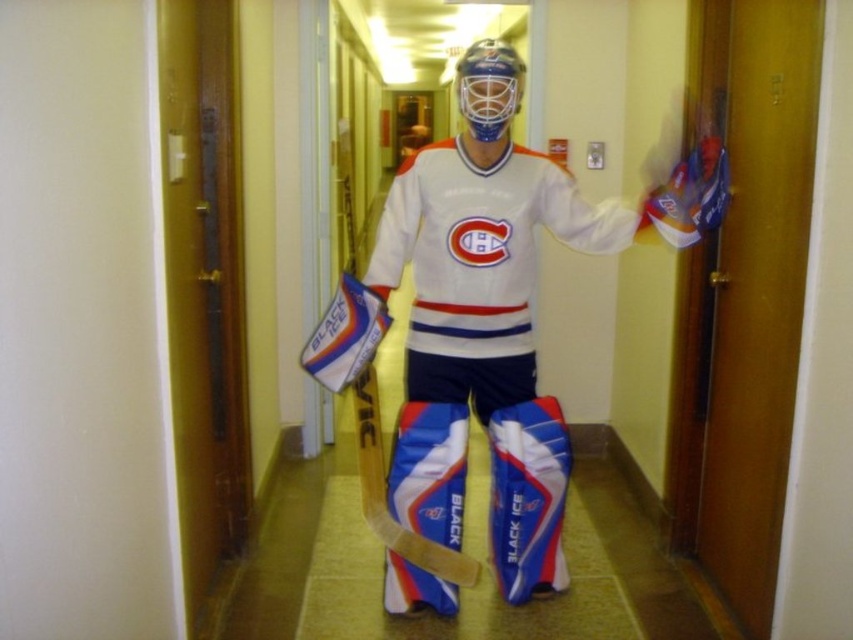
You are a photographer setting up for a hockey team photo. You need to ensure that the white matte jersey at center and the blue and white composite hockey stick at center are both visible in the frame. Given their sizes, which object will appear larger in the photo?

The white matte jersey at center is much taller than the blue and white composite hockey stick at center, so it will appear larger in the photo.

Looking at this image, you are a photographer standing in the hallway and want to take a photo of the person. Since the hallway is narrow, you can only focus on one object at a time. Which object should you focus on first to ensure it is in sharp focus if you want the white matte jersey at center and the blue and white composite hockey stick at center to be in focus?

The white matte jersey at center is closer to the viewer than the blue and white composite hockey stick at center. To ensure both are in focus, you should focus on the white matte jersey at center first, as it is closer, and adjust the focus accordingly to include the hockey stick in the background.